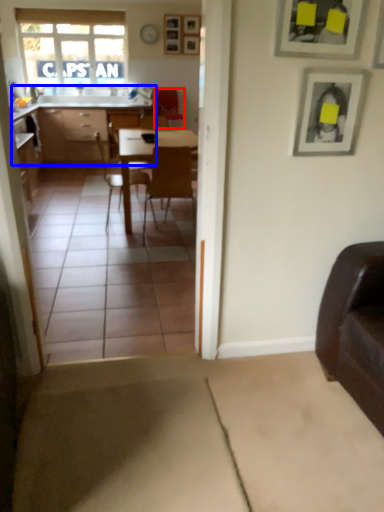
Question: Which object is closer to the camera taking this photo, armchair (highlighted by a red box) or cabinetry (highlighted by a blue box)?

Choices:
 (A) armchair
 (B) cabinetry

Answer: (B)